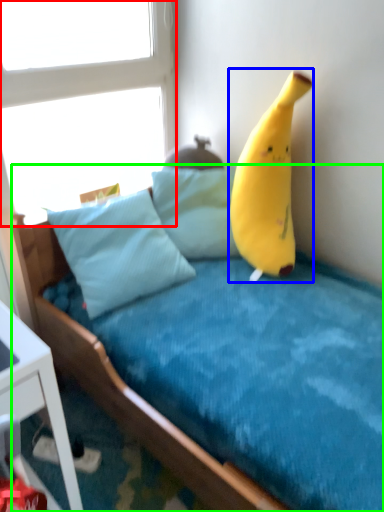
Question: Which object is the farthest from window (highlighted by a red box)? Choose among these: banana (highlighted by a blue box) or bed (highlighted by a green box).

Choices:
 (A) banana
 (B) bed

Answer: (B)